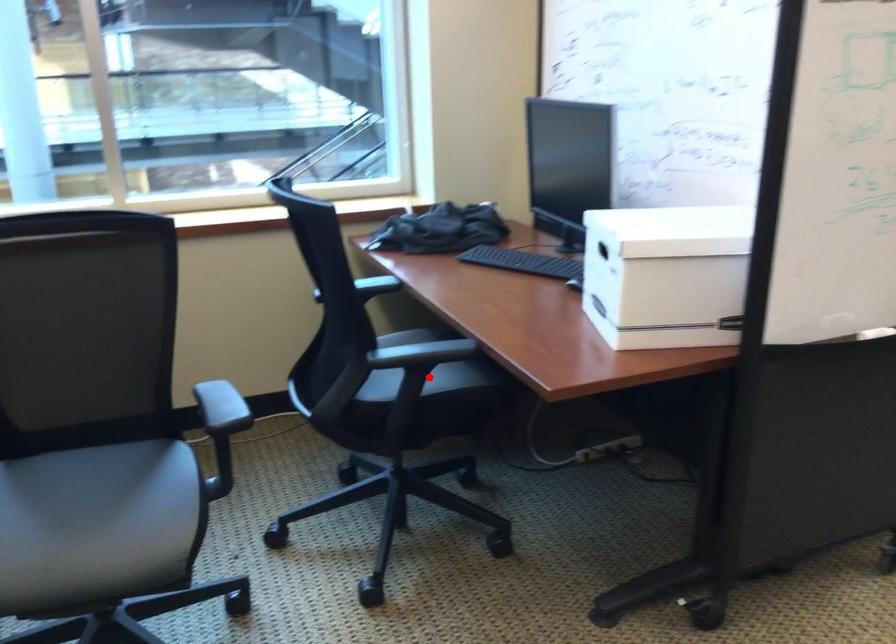
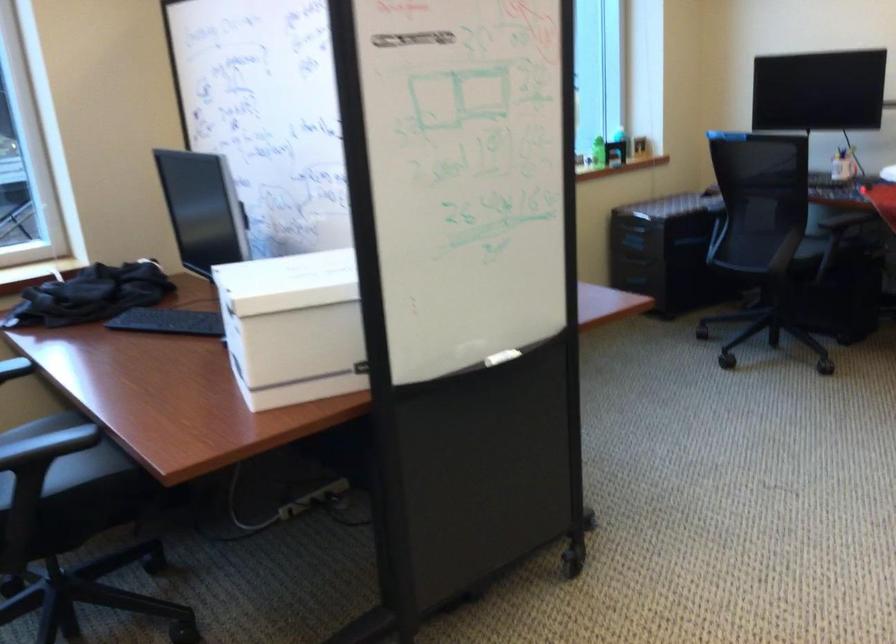
In the second image, find the point that corresponds to the highlighted location in the first image.

(65, 464)